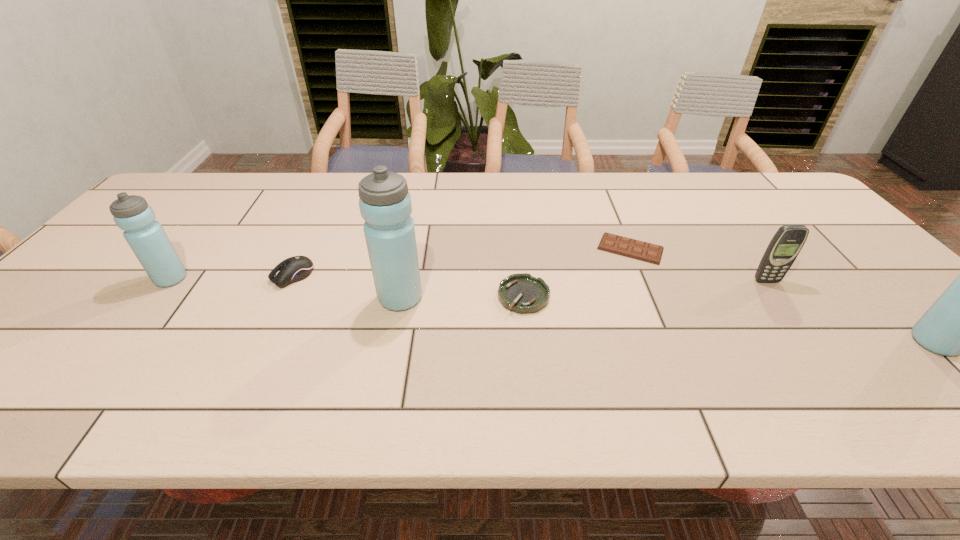
The width and height of the screenshot is (960, 540). I want to click on free space at the far left corner of the desktop, so click(200, 182).

Where is `vacant space that's between the second shortest object and the third object from right to left`? This screenshot has height=540, width=960. vacant space that's between the second shortest object and the third object from right to left is located at coordinates (577, 272).

Where is `vacant space in between the second object from right to left and the third object from left to right`? vacant space in between the second object from right to left and the third object from left to right is located at coordinates (584, 289).

Image resolution: width=960 pixels, height=540 pixels. What are the coordinates of `vacant area that lies between the sixth tallest object and the second object from right to left` in the screenshot? It's located at (645, 288).

The height and width of the screenshot is (540, 960). I want to click on free space between the second water bottle from left to right and the shortest object, so click(x=516, y=273).

Locate an element on the screen. vacant area between the shortest object and the fifth object from right to left is located at coordinates (516, 273).

Find the location of a particular element. vacant area that lies between the ashtray and the shortest water bottle is located at coordinates (348, 287).

The image size is (960, 540). In order to click on free space between the second shortest object and the cellular telephone in this screenshot , I will do `click(645, 288)`.

You are a GUI agent. You are given a task and a screenshot of the screen. Output one action in this format:
    pyautogui.click(x=<x>, y=<y>)
    Task: Click on the vacant area that lies between the third tallest object and the second object from right to left
    Image resolution: width=960 pixels, height=540 pixels.
    Given the screenshot: What is the action you would take?
    pyautogui.click(x=468, y=280)

Locate which object ranks in proximity to the fifth object from left to right. Please provide its 2D coordinates. Your answer should be formatted as a tuple, i.e. [(x, y)], where the tuple contains the x and y coordinates of a point satisfying the conditions above.

[(522, 293)]